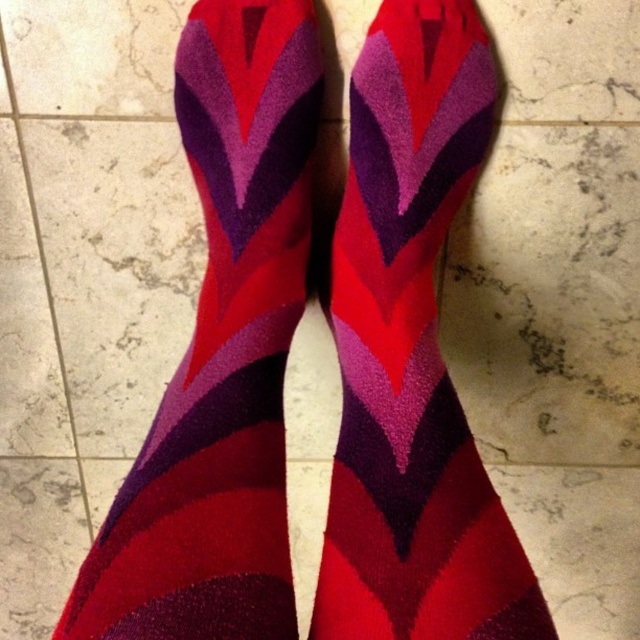
Question: Which object appears farthest from the camera in this image?

Choices:
 (A) matte wool socks at center
 (B) velvet-like red socks at center

Answer: (A)

Question: Can you confirm if velvet-like red socks at center is smaller than matte wool socks at center?

Choices:
 (A) yes
 (B) no

Answer: (B)

Question: Can you confirm if velvet-like red socks at center is positioned to the right of matte wool socks at center?

Choices:
 (A) no
 (B) yes

Answer: (A)

Question: In this image, where is velvet-like red socks at center located relative to matte wool socks at center?

Choices:
 (A) right
 (B) left

Answer: (B)

Question: Among these objects, which one is farthest from the camera?

Choices:
 (A) matte wool socks at center
 (B) velvet-like red socks at center

Answer: (A)